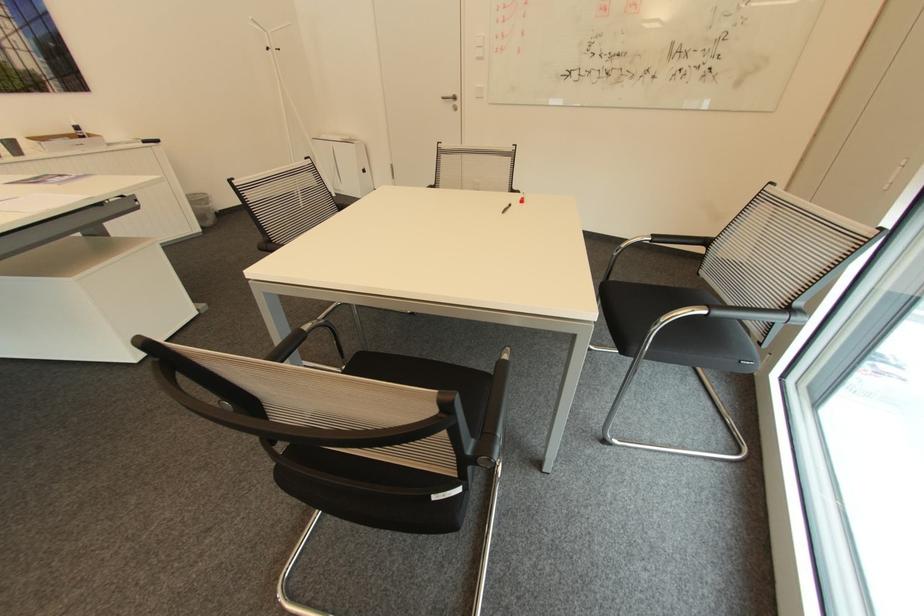
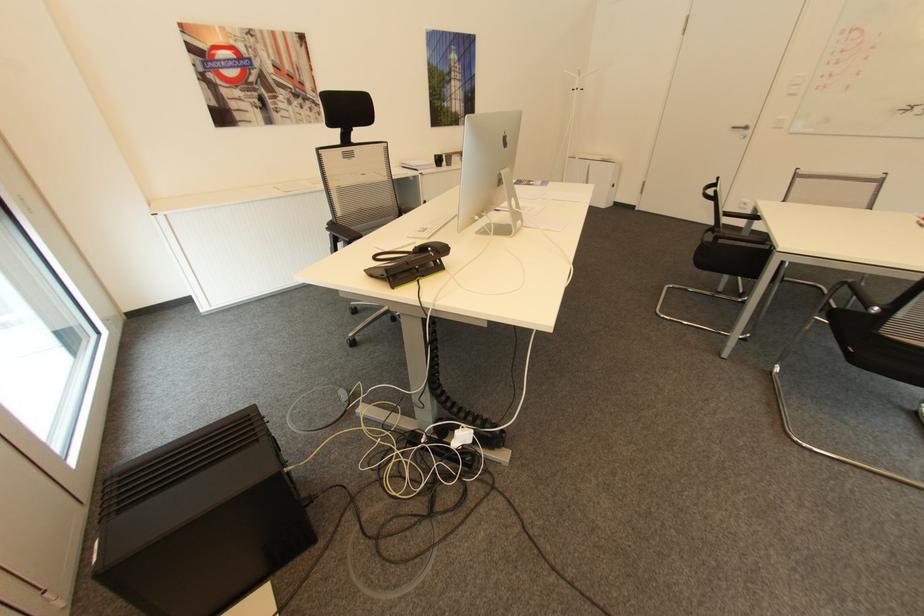
Where in the second image is the point corresponding to the point at 458,98 from the first image?

(749, 128)